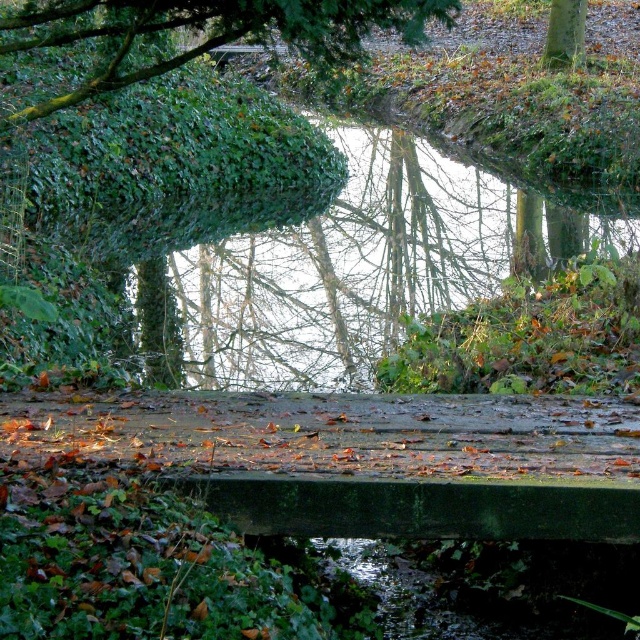
You are standing on the wooden bridge and want to take a photo of the green leafy stream at center. Where should you aim your camera to capture the stream in the best possible way?

To capture the green leafy stream at center, aim your camera towards the position at point coordinates of (x=360, y=266).

In the scene shown: You are an artist planning to paint the scene. You want to ensure the green leafy tree at upper left and the green leafy tree at upper center are proportionally accurate. Which tree should you paint smaller in your painting?

The green leafy tree at upper left should be painted smaller because it occupies less space than the green leafy tree at upper center.